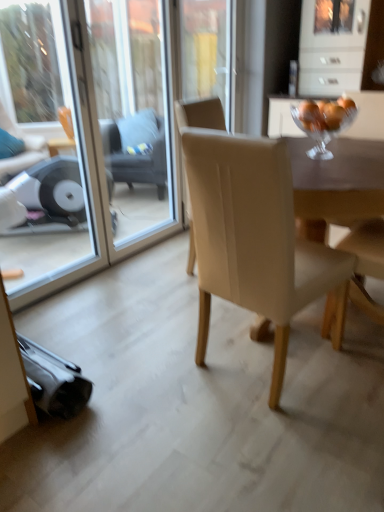
Question: From the image's perspective, is transparent glass screen door at left, which is counted as the 1th screen door, starting from the left, beneath transparent glass screen door at upper center, which appears as the 2th screen door when viewed from the left?

Choices:
 (A) no
 (B) yes

Answer: (B)

Question: Is transparent glass screen door at left, marked as the second screen door in a right-to-left arrangement, oriented towards transparent glass screen door at upper center, which appears as the 2th screen door when viewed from the left?

Choices:
 (A) no
 (B) yes

Answer: (B)

Question: Is transparent glass screen door at left, marked as the second screen door in a right-to-left arrangement, to the left of transparent glass screen door at upper center, which appears as the 2th screen door when viewed from the left, from the viewer's perspective?

Choices:
 (A) no
 (B) yes

Answer: (B)

Question: Would you say transparent glass screen door at left, which is counted as the 1th screen door, starting from the left, is outside transparent glass screen door at upper center, the 1th screen door when ordered from right to left?

Choices:
 (A) yes
 (B) no

Answer: (B)

Question: Considering the relative positions of transparent glass screen door at left, marked as the second screen door in a right-to-left arrangement, and transparent glass screen door at upper center, which appears as the 2th screen door when viewed from the left, in the image provided, is transparent glass screen door at left, marked as the second screen door in a right-to-left arrangement, in front of transparent glass screen door at upper center, which appears as the 2th screen door when viewed from the left,?

Choices:
 (A) yes
 (B) no

Answer: (B)

Question: Is transparent glass screen door at left, marked as the second screen door in a right-to-left arrangement, in contact with transparent glass screen door at upper center, the 1th screen door when ordered from right to left?

Choices:
 (A) no
 (B) yes

Answer: (A)

Question: Can you confirm if dark gray fabric swivel chair at center is smaller than clear glass bowl at upper right?

Choices:
 (A) no
 (B) yes

Answer: (A)

Question: Can you confirm if dark gray fabric swivel chair at center is thinner than clear glass bowl at upper right?

Choices:
 (A) no
 (B) yes

Answer: (A)

Question: Is dark gray fabric swivel chair at center shorter than clear glass bowl at upper right?

Choices:
 (A) yes
 (B) no

Answer: (B)

Question: From a real-world perspective, is dark gray fabric swivel chair at center under clear glass bowl at upper right?

Choices:
 (A) no
 (B) yes

Answer: (B)

Question: Considering the relative positions of dark gray fabric swivel chair at center and clear glass bowl at upper right in the image provided, is dark gray fabric swivel chair at center to the right of clear glass bowl at upper right from the viewer's perspective?

Choices:
 (A) no
 (B) yes

Answer: (A)

Question: Is dark gray fabric swivel chair at center aimed at clear glass bowl at upper right?

Choices:
 (A) yes
 (B) no

Answer: (B)

Question: Is matte beige armchair at right positioned with its back to beige fabric chair at center?

Choices:
 (A) no
 (B) yes

Answer: (A)